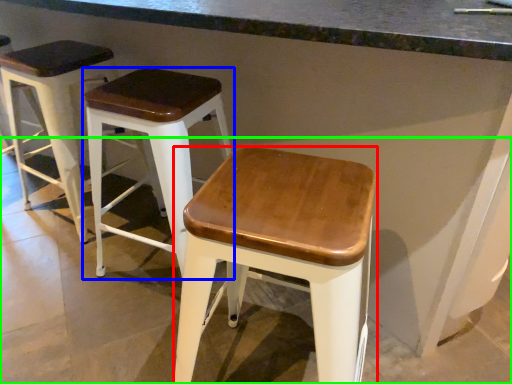
Question: Estimate the real-world distances between objects in this image. Which object is closer to stool (highlighted by a red box), stool (highlighted by a blue box) or concrete (highlighted by a green box)?

Choices:
 (A) stool
 (B) concrete

Answer: (A)